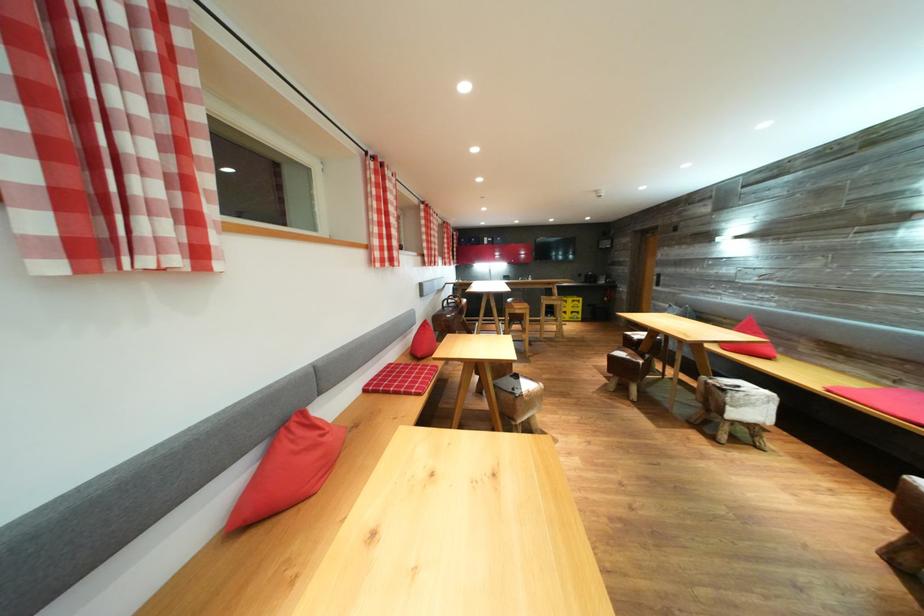
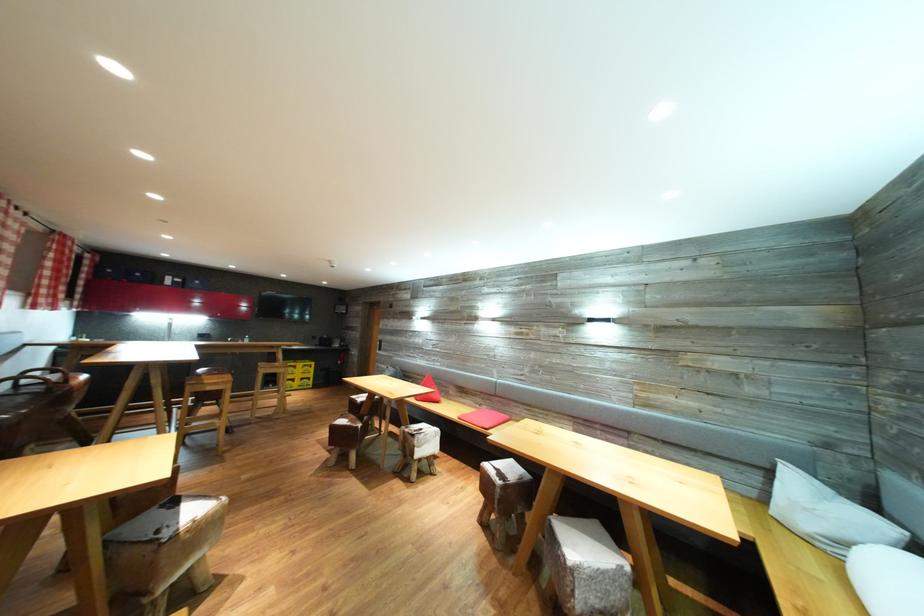
Question: The camera is either moving clockwise (left) or counter-clockwise (right) around the object. The first image is from the beginning of the video and the second image is from the end. Is the camera moving left or right when shooting the video?

Choices:
 (A) Left
 (B) Right

Answer: (A)